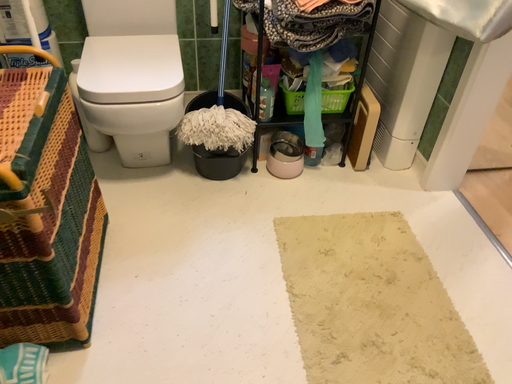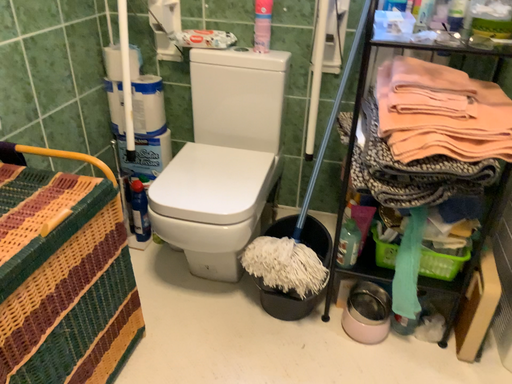
Question: Which way did the camera rotate in the video?

Choices:
 (A) rotated downward
 (B) rotated upward

Answer: (B)